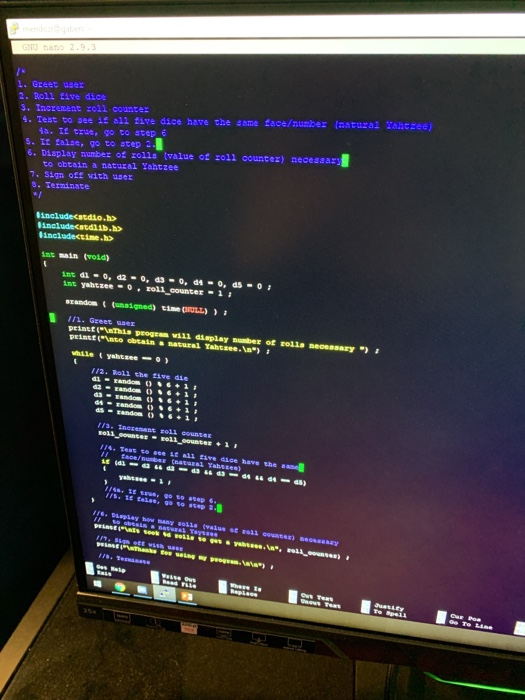
You are a GUI agent. You are given a task and a screenshot of the screen. Output one action in this format:
    pyautogui.click(x=<x>, y=<y>)
    Task: Click on the monitor buttons
    Image resolution: width=525 pixels, height=700 pixels.
    Given the screenshot: What is the action you would take?
    pyautogui.click(x=92, y=614), pyautogui.click(x=119, y=616), pyautogui.click(x=161, y=624), pyautogui.click(x=189, y=626), pyautogui.click(x=222, y=635), pyautogui.click(x=254, y=638), pyautogui.click(x=287, y=644)